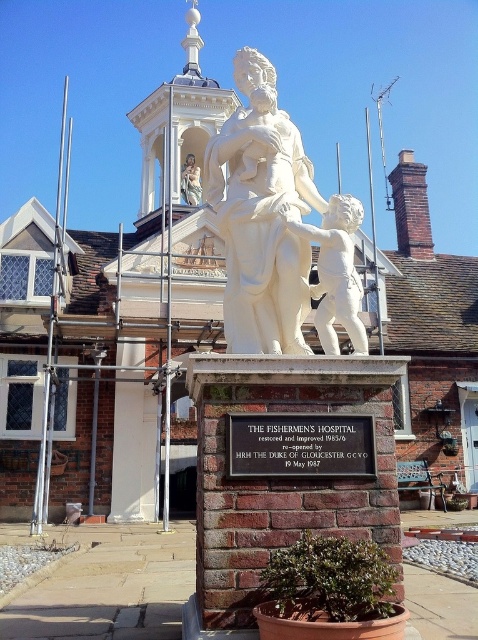
Consider the image. Does black stone plaque at center appear under white marble cherub at center?

Indeed, black stone plaque at center is positioned under white marble cherub at center.

You are a GUI agent. You are given a task and a screenshot of the screen. Output one action in this format:
    pyautogui.click(x=<x>, y=<y>)
    Task: Click on the black stone plaque at center
    The image size is (478, 640).
    Given the screenshot: What is the action you would take?
    pyautogui.click(x=300, y=445)

Does black stone plaque at center have a smaller size compared to smooth marble statue at center?

Yes.

Is black stone plaque at center wider than smooth marble statue at center?

Yes, black stone plaque at center is wider than smooth marble statue at center.

Does point (315, 468) come farther from viewer compared to point (184, 180)?

No.

You are a GUI agent. You are given a task and a screenshot of the screen. Output one action in this format:
    pyautogui.click(x=<x>, y=<y>)
    Task: Click on the black stone plaque at center
    
    Given the screenshot: What is the action you would take?
    pyautogui.click(x=300, y=445)

Between white marble statue at center and white marble cherub at center, which one is positioned higher?

white marble statue at center is higher up.

Is point (250, 291) positioned behind point (347, 216)?

Yes, it is.

This screenshot has width=478, height=640. Find the location of `white marble statue at center`. white marble statue at center is located at coordinates (261, 216).